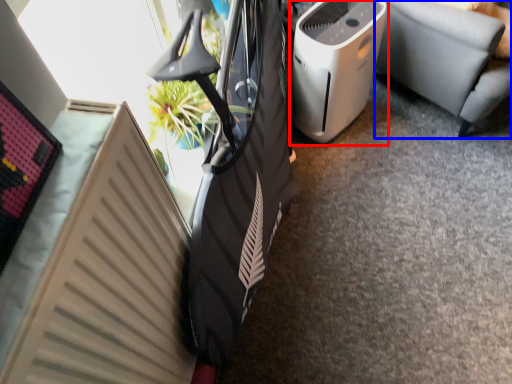
Question: Which object appears closest to the camera in this image, home appliance (highlighted by a red box) or furniture (highlighted by a blue box)?

Choices:
 (A) home appliance
 (B) furniture

Answer: (B)